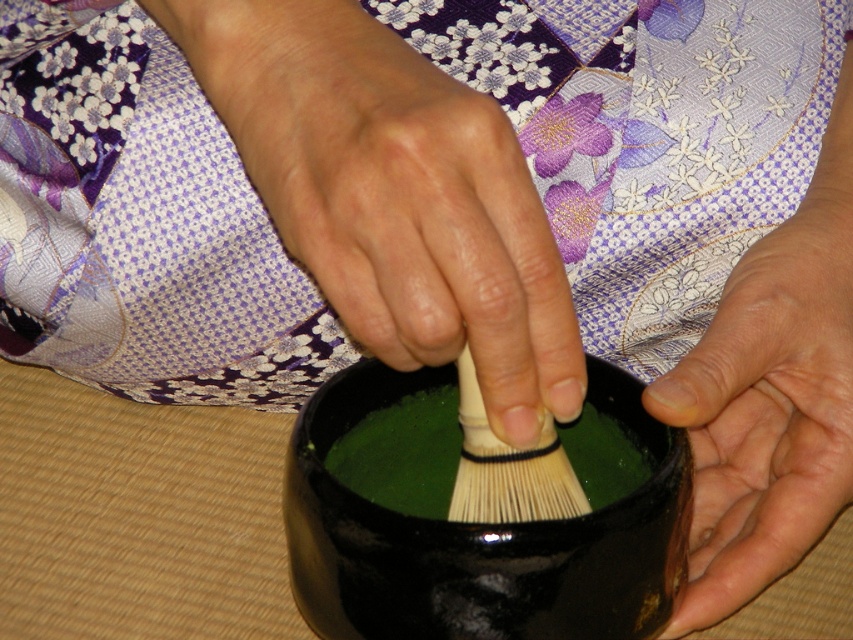
You are a photographer taking a closeup shot of the hands performing the tea ceremony. The smooth skin palm at lower right is part of the composition. You want to ensure that both the hands and the tea bowl are in focus. What should you adjust in your camera settings to achieve this?

To ensure both the hands and the tea bowl are in focus, adjust the camera aperture to a smaller opening, like f8 or higher, to increase the depth of field. This will keep both the foreground hands and the background tea bowl sharp.

What object is located at the coordinates point (393, 195) in the scene?

The smooth beige brush at center is located at point (393, 195).